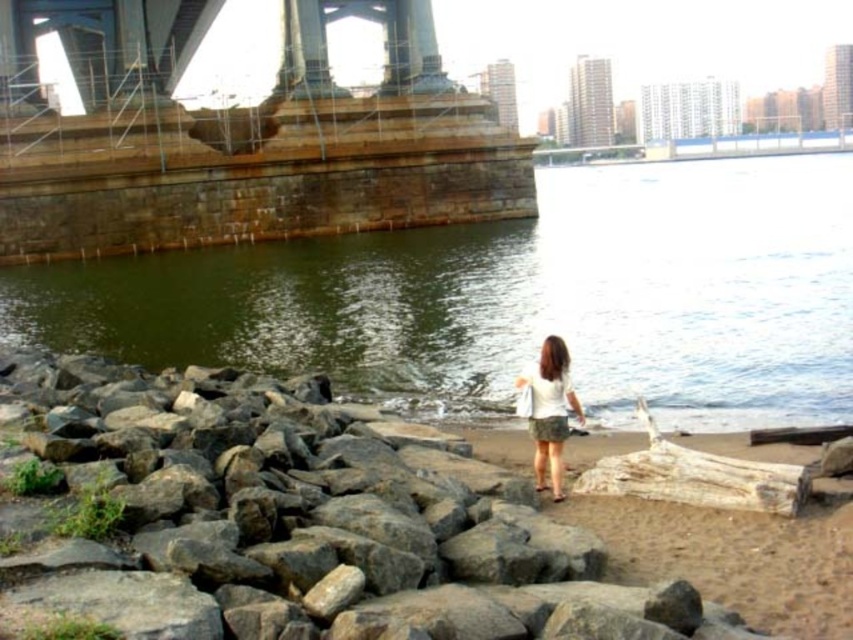
You are standing at the riverside and see the gray rock at lower center and the white fabric skirt at lower right. Which object is closer to you?

The gray rock at lower center is closer to you because it is in front of the white fabric skirt at lower right.

You are standing at the point marked by the coordinates point (282, 522). Looking around, you see a gray rock at lower center. Which direction should you walk to reach the gray rock at lower center?

You are already at the gray rock at lower center because the point (282, 522) is on the gray rock at lower center.